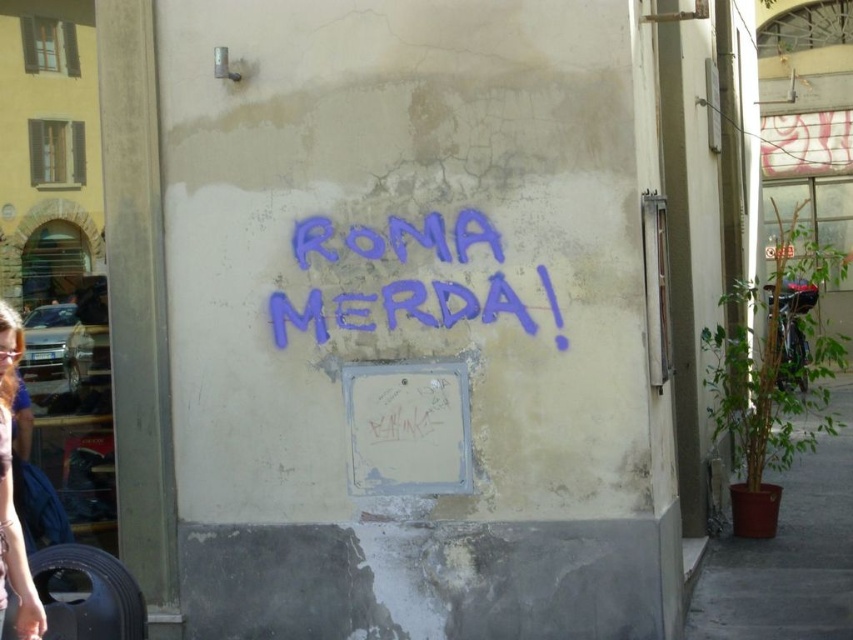
Question: Which of the following is the closest to the observer?

Choices:
 (A) purple spray paint graffiti at center
 (B) matte purple shirt at lower left

Answer: (B)

Question: Which point appears closest to the camera in this image?

Choices:
 (A) (517, 301)
 (B) (9, 307)

Answer: (A)

Question: Does purple spray paint graffiti at center have a greater width compared to matte purple shirt at lower left?

Choices:
 (A) no
 (B) yes

Answer: (B)

Question: Can you confirm if purple spray paint graffiti at center is smaller than matte purple shirt at lower left?

Choices:
 (A) yes
 (B) no

Answer: (B)

Question: Is purple spray paint graffiti at center to the right of matte purple shirt at lower left from the viewer's perspective?

Choices:
 (A) yes
 (B) no

Answer: (A)